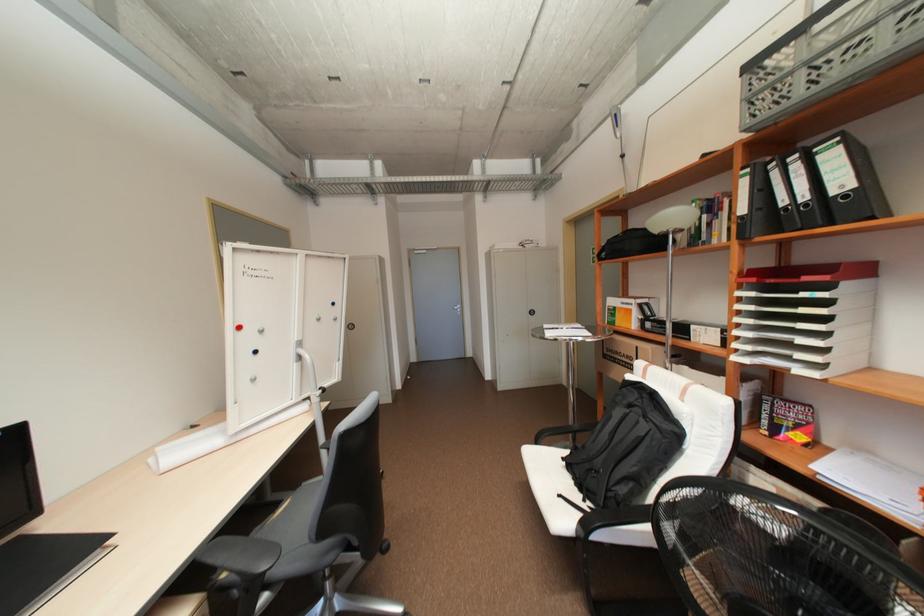
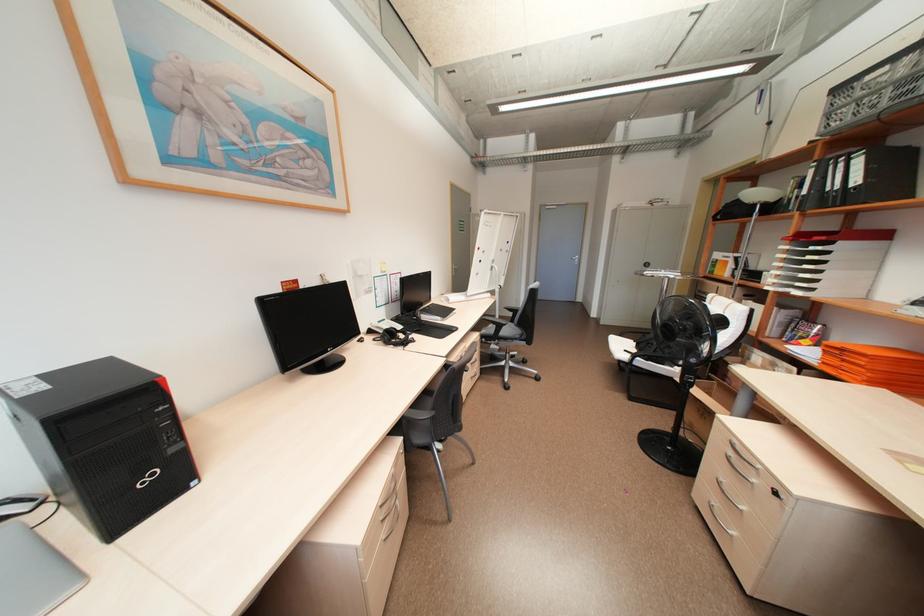
Where in the second image is the point corresponding to pixel 837 156 from the first image?

(865, 161)